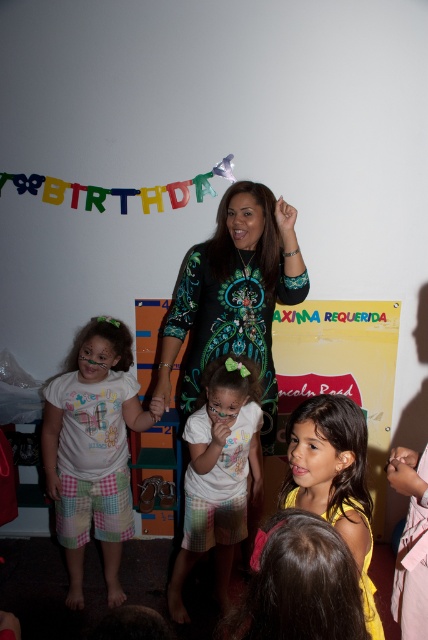
You are a photographer at the birthday party and want to capture a photo of the white cotton shirt at center and the yellow fabric dress at center. From the perspective of the photographer, which one is on the left side?

The white cotton shirt at center is to the left of the yellow fabric dress at center, so the white cotton shirt at center is on the left side from the photographer perspective.

You are a photographer at the birthday party and want to take a photo of the printed fabric dress at center and the white cotton shirt at left. Which one should you focus on first if you want to capture both in the frame?

The printed fabric dress at center is not as tall as the white cotton shirt at left, so you should focus on the white cotton shirt at left first to ensure it is fully in frame before adjusting for the shorter printed fabric dress at center.

You are a photographer at the birthday party and want to position yourself so that the printed fabric dress at center is exactly in the center of your camera frame. What coordinates should you aim for?

The printed fabric dress at center is located at coordinates point (234, 294), so you should aim your camera at those coordinates to center it.